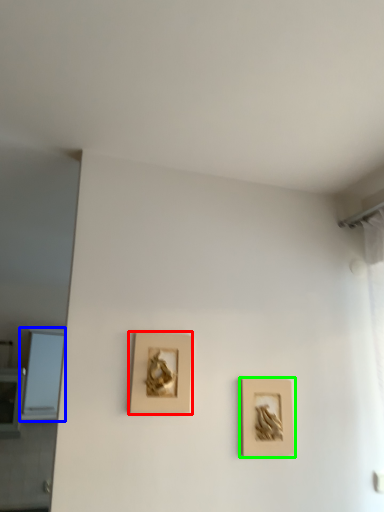
Question: Estimate the real-world distances between objects in this image. Which object is closer to picture frame (highlighted by a red box), window (highlighted by a blue box) or picture frame (highlighted by a green box)?

Choices:
 (A) window
 (B) picture frame

Answer: (B)